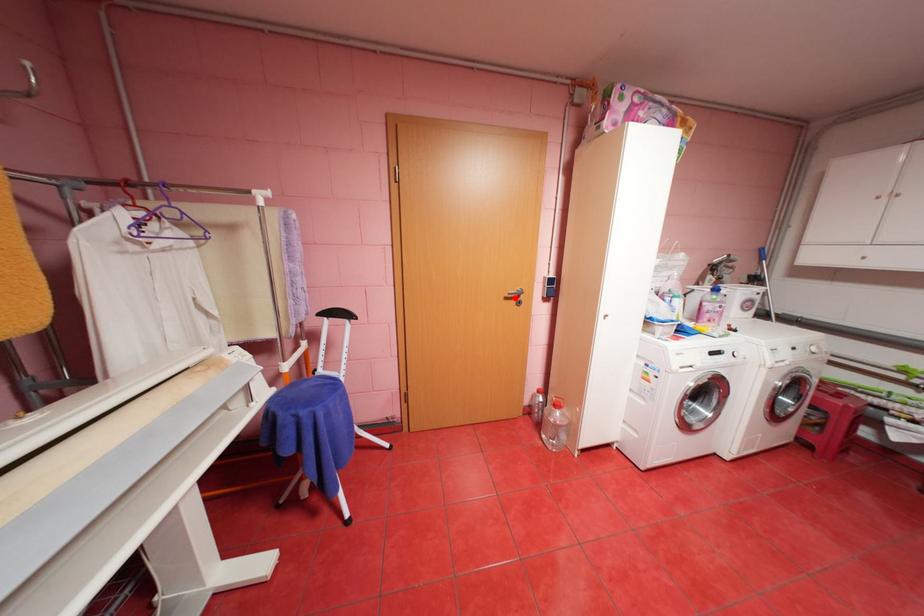
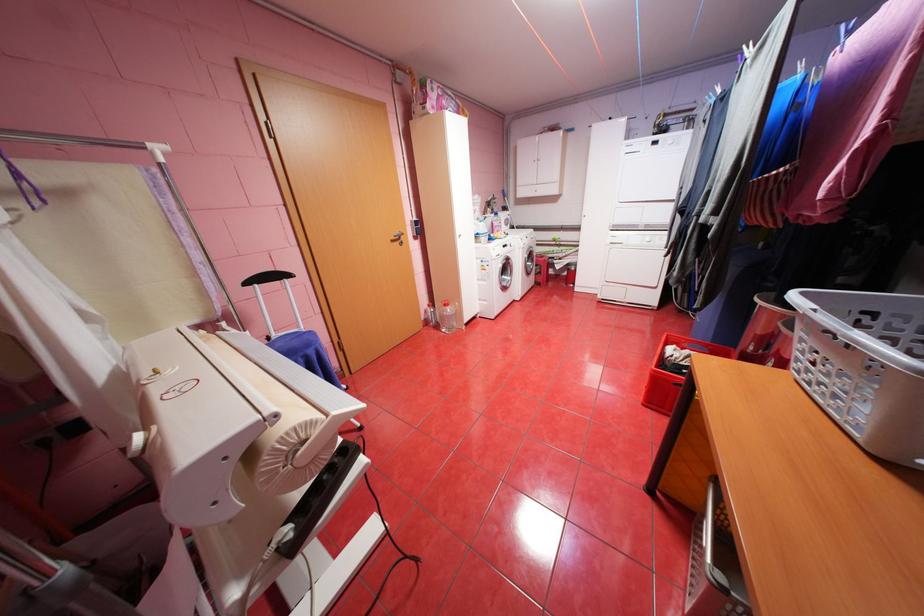
Question: I am providing you with two images of the same scene from different viewpoints. A red point is shown in image1. For the corresponding object point in image2, is it positioned nearer or farther from the camera?

Choices:
 (A) Nearer
 (B) Farther

Answer: (A)